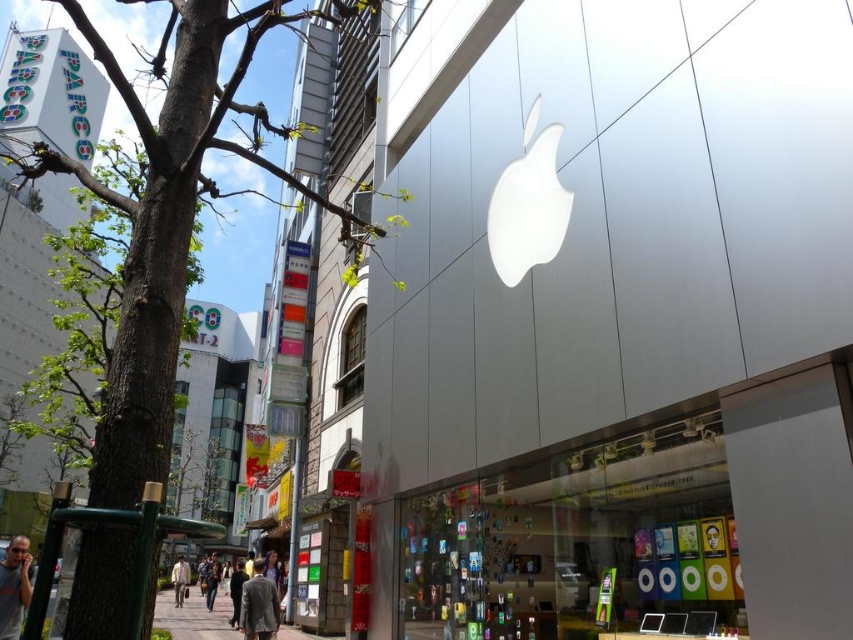
Question: Which point is closer to the camera?

Choices:
 (A) brown leather jacket at lower center
 (B) light yellow shirt at lower center
 (C) gray fabric shirt at lower left

Answer: (C)

Question: Does brown leather jacket at lower center have a lesser width compared to light yellow shirt at lower center?

Choices:
 (A) yes
 (B) no

Answer: (B)

Question: Is sleek silver store at center wider than light yellow shirt at lower center?

Choices:
 (A) yes
 (B) no

Answer: (B)

Question: Is black fabric pants at lower center above light yellow shirt at lower center?

Choices:
 (A) yes
 (B) no

Answer: (A)

Question: Among these points, which one is farthest from the camera?

Choices:
 (A) (262, 628)
 (B) (173, 576)
 (C) (138, 392)

Answer: (B)

Question: Estimate the real-world distances between objects in this image. Which object is closer to the gray wool coat at lower center?

Choices:
 (A) sleek silver store at center
 (B) brown leather jacket at lower center
 (C) black fabric pants at lower center
 (D) light yellow shirt at lower center

Answer: (A)